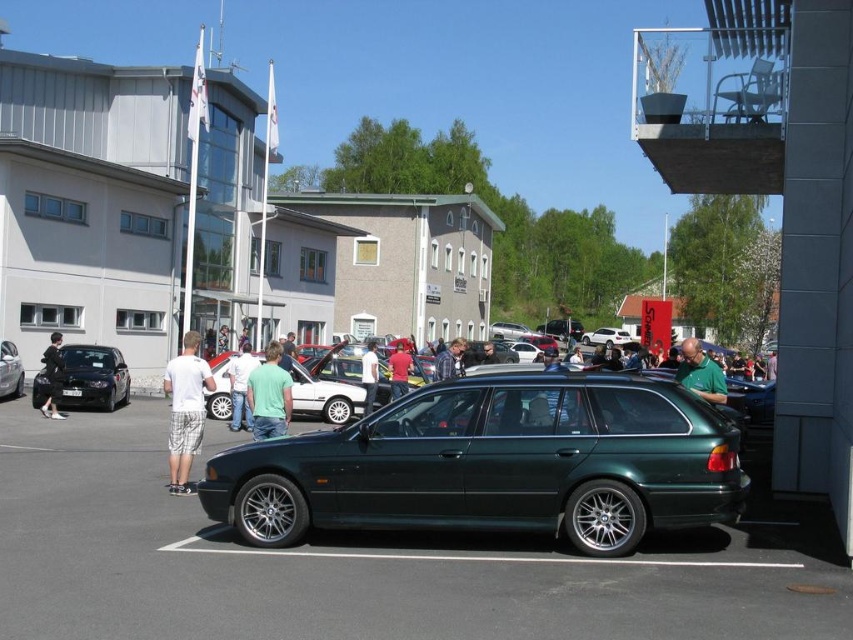
Question: Which object appears closest to the camera in this image?

Choices:
 (A) green matte car at center
 (B) dark green fabric jacket at center
 (C) green metallic car at center

Answer: (C)

Question: Which point is farther from the camera taking this photo?

Choices:
 (A) (55, 365)
 (B) (607, 340)
 (C) (370, 385)

Answer: (B)

Question: Considering the relative positions of plaid shirt at center and matte black car at center in the image provided, where is plaid shirt at center located with respect to matte black car at center?

Choices:
 (A) left
 (B) right

Answer: (A)

Question: Can you confirm if green cotton shirt at center is smaller than green fabric shirt at center?

Choices:
 (A) yes
 (B) no

Answer: (A)

Question: Which object is farther from the camera taking this photo?

Choices:
 (A) metallic silver car at center
 (B) green shirt at center

Answer: (A)

Question: Is green cotton shirt at center smaller than dark green fabric jacket at center?

Choices:
 (A) yes
 (B) no

Answer: (A)